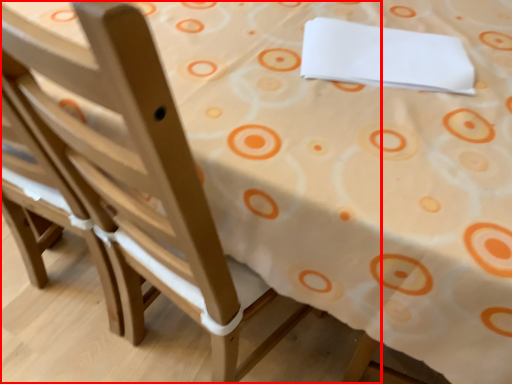
Question: From the image's perspective, considering the relative positions of chair (annotated by the red box) and linen in the image provided, where is chair (annotated by the red box) located with respect to the staircase?

Choices:
 (A) below
 (B) above

Answer: (A)